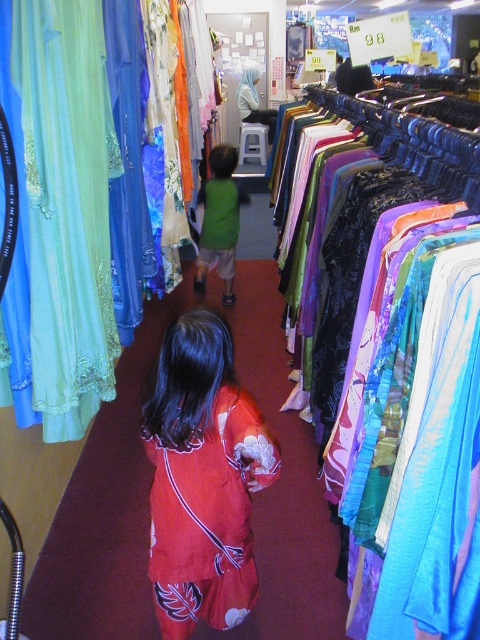
You are a customer in the store and want to compare the shiny blue fabric at right and the green matte shirt at center. Which one is located to the right of the other?

The shiny blue fabric at right is positioned on the right side of green matte shirt at center.

Consider the image. You are standing in the clothing store and want to reach the point marked at coordinates (231, 611). If you can move forward 1.6 meters, will you be able to reach that point?

The distance of point (231, 611) from camera is 1.65 meters. Since you can move forward 1.6 meters, you will not quite reach the point as you need to move an additional 0.05 meters.